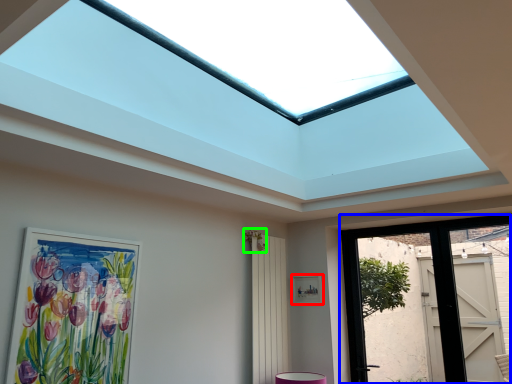
Question: Which object is positioned closest to picture frame (highlighted by a red box)? Select from door (highlighted by a blue box) and flower (highlighted by a green box).

Choices:
 (A) door
 (B) flower

Answer: (B)